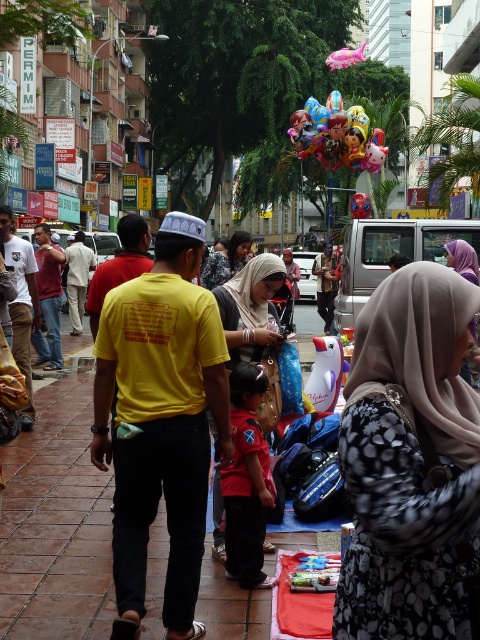
Question: Which object is closer to the camera taking this photo?

Choices:
 (A) yellow cotton shirt at center
 (B) floral-patterned hijab at center

Answer: (B)

Question: Is yellow cotton shirt at center thinner than translucent plastic balloon at center?

Choices:
 (A) yes
 (B) no

Answer: (A)

Question: Estimate the real-world distances between objects in this image. Which object is closer to the matte beige hijab at center?

Choices:
 (A) translucent plastic balloon at center
 (B) floral-patterned hijab at center
 (C) yellow cotton shirt at center

Answer: (C)

Question: Which point is closer to the camera?

Choices:
 (A) glossy metallic balloons at center
 (B) floral-patterned hijab at center
 (C) translucent plastic balloon at center
 (D) yellow cotton shirt at center

Answer: (B)

Question: Can you confirm if yellow cotton shirt at center is positioned to the left of matte beige hijab at center?

Choices:
 (A) no
 (B) yes

Answer: (B)

Question: Does yellow cotton shirt at center appear on the right side of translucent plastic balloon at center?

Choices:
 (A) yes
 (B) no

Answer: (B)